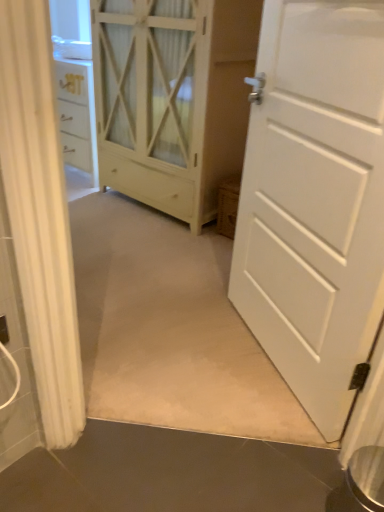
Question: Is white wood cupboard at center to the left or to the right of white matte door at right in the image?

Choices:
 (A) left
 (B) right

Answer: (A)

Question: Is white wood cupboard at center situated inside white matte door at right or outside?

Choices:
 (A) inside
 (B) outside

Answer: (B)

Question: In terms of height, does white wood cupboard at center look taller or shorter compared to white matte door at right?

Choices:
 (A) short
 (B) tall

Answer: (B)

Question: Is point (372, 159) closer or farther from the camera than point (139, 40)?

Choices:
 (A) closer
 (B) farther

Answer: (A)

Question: From the image's perspective, is white matte door at right located above or below white wood cupboard at center?

Choices:
 (A) below
 (B) above

Answer: (A)

Question: Considering the positions of white matte door at right and white wood cupboard at center in the image, is white matte door at right bigger or smaller than white wood cupboard at center?

Choices:
 (A) big
 (B) small

Answer: (B)

Question: Visually, is white matte door at right positioned to the left or to the right of white wood cupboard at center?

Choices:
 (A) left
 (B) right

Answer: (B)